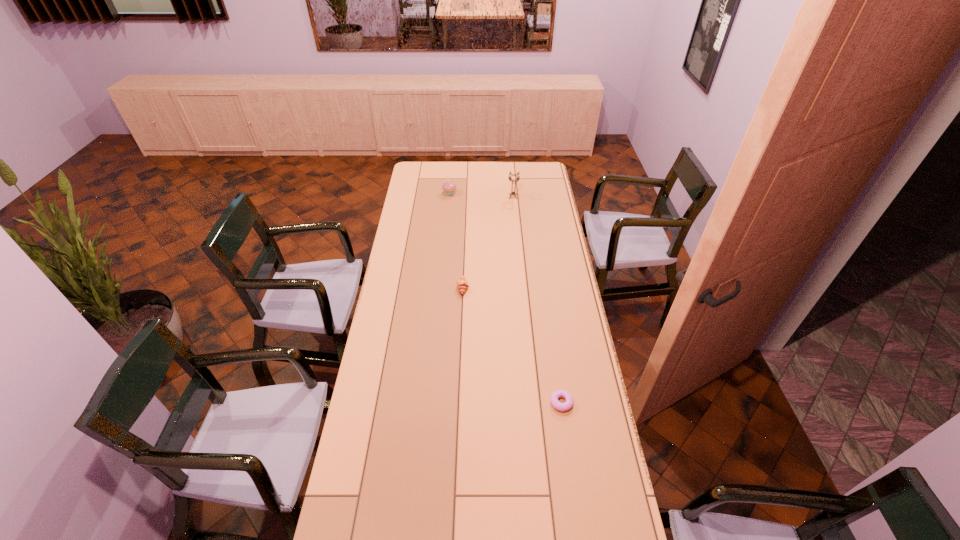
Locate an element on the screen. vacant space in between the leftmost object and the second object from right to left is located at coordinates (481, 195).

Where is `free space between the tallest object and the leftmost object`? Image resolution: width=960 pixels, height=540 pixels. free space between the tallest object and the leftmost object is located at coordinates (481, 195).

The height and width of the screenshot is (540, 960). I want to click on free space between the shortest object and the cupcake, so click(506, 298).

At what (x,y) coordinates should I click in order to perform the action: click on the second closest object to the pastry. Please return your answer as a coordinate pair (x, y). Image resolution: width=960 pixels, height=540 pixels. Looking at the image, I should click on (449, 187).

Identify which object is located as the second nearest to the nearest object. Please provide its 2D coordinates. Your answer should be formatted as a tuple, i.e. [(x, y)], where the tuple contains the x and y coordinates of a point satisfying the conditions above.

[(518, 177)]

Locate an element on the screen. vacant region that satisfies the following two spatial constraints: 1. on the back side of the doughnut; 2. on the front-facing side of the third farthest object is located at coordinates (544, 288).

You are a GUI agent. You are given a task and a screenshot of the screen. Output one action in this format:
    pyautogui.click(x=<x>, y=<y>)
    Task: Click on the vacant region that satisfies the following two spatial constraints: 1. on the front-facing side of the shortest object; 2. on the left side of the second shortest object
    
    Given the screenshot: What is the action you would take?
    pyautogui.click(x=458, y=403)

The width and height of the screenshot is (960, 540). I want to click on vacant area that satisfies the following two spatial constraints: 1. on the back side of the shortest object; 2. on the front-facing side of the second nearest object, so [x=544, y=288].

Where is `free spot that satisfies the following two spatial constraints: 1. on the front side of the leftmost object; 2. on the left side of the second object from right to left`? This screenshot has height=540, width=960. free spot that satisfies the following two spatial constraints: 1. on the front side of the leftmost object; 2. on the left side of the second object from right to left is located at coordinates (449, 197).

Find the location of a particular element. This screenshot has height=540, width=960. vacant region that satisfies the following two spatial constraints: 1. on the front side of the rightmost object; 2. on the right side of the candle holder is located at coordinates (533, 403).